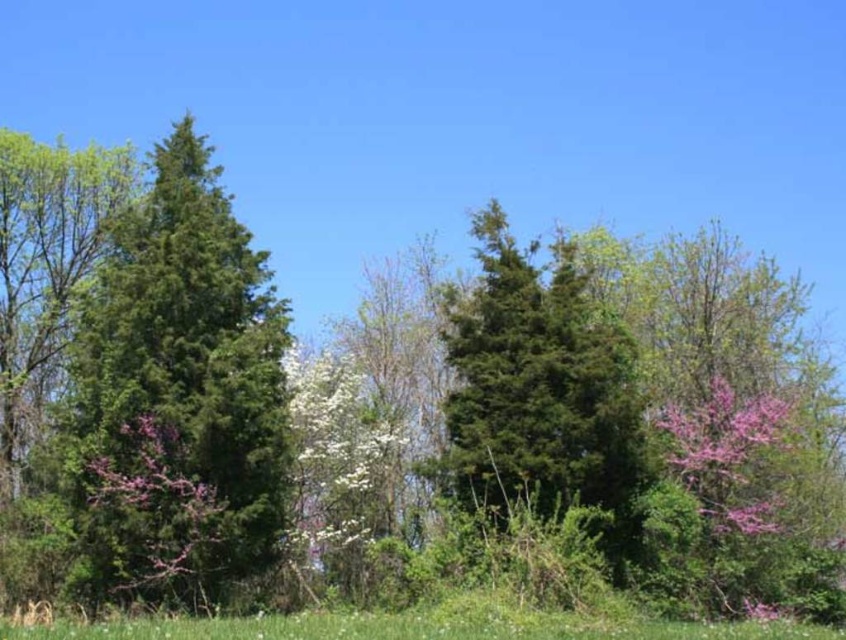
Question: Which of the following is the farthest from the observer?

Choices:
 (A) green needle-like tree at left
 (B) green needle-like at center
 (C) green grass at lower center

Answer: (A)

Question: Is green needle-like tree at left closer to the viewer compared to green needle-like at center?

Choices:
 (A) no
 (B) yes

Answer: (A)

Question: From the image, what is the correct spatial relationship of green needle-like tree at left in relation to green needle-like at center?

Choices:
 (A) right
 (B) left

Answer: (B)

Question: Among these objects, which one is nearest to the camera?

Choices:
 (A) green grass at lower center
 (B) green needle-like at center
 (C) green needle-like tree at left

Answer: (A)

Question: Where is green needle-like tree at left located in relation to green needle-like at center in the image?

Choices:
 (A) above
 (B) below

Answer: (A)

Question: Which point appears farthest from the camera in this image?

Choices:
 (A) (275, 317)
 (B) (369, 634)
 (C) (640, 451)

Answer: (A)